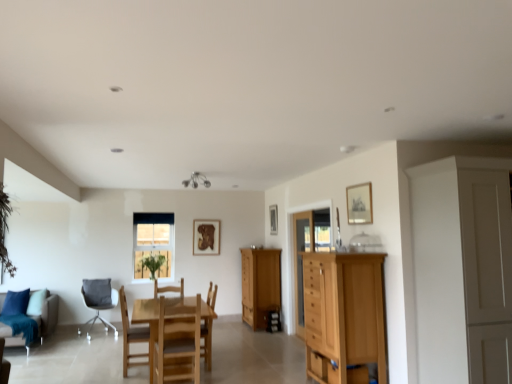
In order to click on light brown wood chest of drawers at right in this screenshot , I will do `click(344, 314)`.

How much space does transparent glass cabinet at center-right, acting as the second glass door starting from the left, occupy vertically?

transparent glass cabinet at center-right, acting as the second glass door starting from the left, is 2.08 meters tall.

I want to click on wooden chair at center, the third chair positioned from the left, so pos(133,338).

What is the approximate width of white fabric chair at lower left, which appears as the 4th chair when viewed from the front?

The width of white fabric chair at lower left, which appears as the 4th chair when viewed from the front, is 59.56 centimeters.

Describe the element at coordinates (47, 316) in the screenshot. I see `teal fabric couch at lower left` at that location.

Identify the location of light brown wood chest of drawers at right. (344, 314).

Does wooden picture frame at upper center, acting as the second picture frame starting from the right, touch wooden picture frame at upper right, arranged as the third picture frame when viewed from the left?

No, wooden picture frame at upper center, acting as the second picture frame starting from the right, is not in contact with wooden picture frame at upper right, arranged as the third picture frame when viewed from the left.

Find the location of a particular element. This screenshot has height=384, width=512. picture frame lying on the right of wooden picture frame at upper center, positioned as the second picture frame in front-to-back order is located at coordinates (359, 204).

Is wooden picture frame at upper center, positioned as the second picture frame in front-to-back order, surrounding wooden picture frame at upper right, marked as the first picture frame in a right-to-left arrangement?

Actually, wooden picture frame at upper right, marked as the first picture frame in a right-to-left arrangement, is outside wooden picture frame at upper center, positioned as the second picture frame in front-to-back order.

Measure the distance from wooden picture frame at upper center, positioned as the second picture frame in front-to-back order, to wooden picture frame at upper right, the 3th picture frame in the back-to-front sequence.

The distance of wooden picture frame at upper center, positioned as the second picture frame in front-to-back order, from wooden picture frame at upper right, the 3th picture frame in the back-to-front sequence, is 3.03 meters.

Is wooden picture frame at upper center, positioned as the second picture frame in front-to-back order, not close to wooden chair at center, the 3th chair positioned from the right?

Absolutely, wooden picture frame at upper center, positioned as the second picture frame in front-to-back order, is distant from wooden chair at center, the 3th chair positioned from the right.

Is point (273, 207) farther from camera compared to point (146, 330)?

Yes.

From a real-world perspective, is wooden picture frame at upper center, positioned as the second picture frame in front-to-back order, located beneath wooden chair at center, the second chair positioned from the left?

Incorrect, from a real-world perspective, wooden picture frame at upper center, positioned as the second picture frame in front-to-back order, is higher than wooden chair at center, the second chair positioned from the left.

From the image's perspective, between wooden picture frame at upper center, positioned as the second picture frame in front-to-back order, and wooden chair at center, the 3th chair positioned from the right, who is located below?

From the image's view, wooden chair at center, the 3th chair positioned from the right, is below.

Between wooden chair at center, the 4th chair when ordered from back to front, and green leafy plant at center, which one has larger width?

wooden chair at center, the 4th chair when ordered from back to front.

Considering the relative sizes of wooden chair at center, the first chair in the front-to-back sequence, and green leafy plant at center in the image provided, is wooden chair at center, the first chair in the front-to-back sequence, bigger than green leafy plant at center?

Yes, wooden chair at center, the first chair in the front-to-back sequence, is bigger than green leafy plant at center.

Is wooden chair at center, the first chair in the front-to-back sequence, in front of or behind green leafy plant at center in the image?

Clearly, wooden chair at center, the first chair in the front-to-back sequence, is in front of green leafy plant at center.

Measure the distance from wooden chair at center, the third chair positioned from the left, to green leafy plant at center.

A distance of 2.22 meters exists between wooden chair at center, the third chair positioned from the left, and green leafy plant at center.

How many degrees apart are the facing directions of wooden picture frame at upper center, acting as the 2th picture frame starting from the left, and teal fabric couch at lower left?

wooden picture frame at upper center, acting as the 2th picture frame starting from the left, and teal fabric couch at lower left are facing 90.4 degrees away from each other.

The width and height of the screenshot is (512, 384). In order to click on studio couch lying on the left of wooden picture frame at upper center, acting as the second picture frame starting from the right in this screenshot , I will do coord(47,316).

From a real-world perspective, is wooden picture frame at upper center, positioned as the 2th picture frame in back-to-front order, over teal fabric couch at lower left?

Correct, in the physical world, wooden picture frame at upper center, positioned as the 2th picture frame in back-to-front order, is higher than teal fabric couch at lower left.

Is wooden picture frame at upper center, positioned as the second picture frame in front-to-back order, completely or partially outside of teal fabric couch at lower left?

Absolutely, wooden picture frame at upper center, positioned as the second picture frame in front-to-back order, is external to teal fabric couch at lower left.

Is white fabric chair at lower left, marked as the 4th chair in a right-to-left arrangement, next to wooden cabinet at center?

Answer: No, white fabric chair at lower left, marked as the 4th chair in a right-to-left arrangement, is not touching wooden cabinet at center.

Considering the relative sizes of white fabric chair at lower left, which appears as the 4th chair when viewed from the front, and wooden cabinet at center in the image provided, is white fabric chair at lower left, which appears as the 4th chair when viewed from the front, taller than wooden cabinet at center?

No.

Would you say white fabric chair at lower left, marked as the 4th chair in a right-to-left arrangement, is to the left or to the right of wooden cabinet at center in the picture?

Based on their positions, white fabric chair at lower left, marked as the 4th chair in a right-to-left arrangement, is located to the left of wooden cabinet at center.

Are wooden picture frame at center, marked as the 3th picture frame in a right-to-left arrangement, and wooden frame at center far apart?

They are positioned close to each other.

Find the location of `the 1st picture frame counting from the right of the wooden frame at center`. the 1st picture frame counting from the right of the wooden frame at center is located at coordinates (206, 237).

From a real-world perspective, does wooden picture frame at center, which appears as the 3th picture frame when viewed from the front, stand above wooden frame at center?

Yes.

Is wooden picture frame at center, the first picture frame in the left-to-right sequence, taller or shorter than wooden frame at center?

In the image, wooden picture frame at center, the first picture frame in the left-to-right sequence, appears to be shorter than wooden frame at center.

In terms of size, does transparent glass cabinet at center, which is counted as the first glass door, starting from the left, appear bigger or smaller than wooden picture frame at upper center, acting as the 2th picture frame starting from the left?

Considering their sizes, transparent glass cabinet at center, which is counted as the first glass door, starting from the left, takes up more space than wooden picture frame at upper center, acting as the 2th picture frame starting from the left.

Does point (293, 233) come farther from viewer compared to point (270, 226)?

No, it is not.

Which object is further away from the camera taking this photo, transparent glass cabinet at center, the second glass door positioned from the right, or wooden picture frame at upper center, positioned as the 2th picture frame in back-to-front order?

Positioned behind is wooden picture frame at upper center, positioned as the 2th picture frame in back-to-front order.

Is transparent glass cabinet at center, the second glass door positioned from the right, aimed at wooden picture frame at upper center, acting as the 2th picture frame starting from the left?

No, transparent glass cabinet at center, the second glass door positioned from the right, is not aimed at wooden picture frame at upper center, acting as the 2th picture frame starting from the left.

This screenshot has width=512, height=384. What are the coordinates of `picture frame that is in front of the wooden picture frame at upper center, positioned as the second picture frame in front-to-back order` in the screenshot? It's located at (359, 204).

The image size is (512, 384). Identify the location of the 2nd picture frame positioned above the wooden chair at center, which appears as the 3th chair when viewed from the back (from a real-world perspective). (273, 219).

When comparing their distances from transparent glass cabinet at center-right, acting as the second glass door starting from the left, does wooden picture frame at upper right, the 3th picture frame in the back-to-front sequence, or wooden picture frame at upper center, acting as the 2th picture frame starting from the left, seem further?

The object further to transparent glass cabinet at center-right, acting as the second glass door starting from the left, is wooden picture frame at upper center, acting as the 2th picture frame starting from the left.

From the image, which object appears to be farther from wooden chair at center, the first chair in the front-to-back sequence, transparent glass cabinet at center, the second glass door positioned from the right, or wooden picture frame at upper right, arranged as the third picture frame when viewed from the left?

Among the two, wooden picture frame at upper right, arranged as the third picture frame when viewed from the left, is located further to wooden chair at center, the first chair in the front-to-back sequence.

Considering their positions, is transparent glass cabinet at center, the second glass door positioned from the right, positioned further to white fabric chair at lower left, positioned as the 1th chair in back-to-front order, than wooden picture frame at upper right, marked as the first picture frame in a right-to-left arrangement?

wooden picture frame at upper right, marked as the first picture frame in a right-to-left arrangement, is further to white fabric chair at lower left, positioned as the 1th chair in back-to-front order.

Based on the photo, considering their positions, is wooden chair at center, the 2th chair when ordered from front to back, positioned further to wooden cabinet at center than wooden frame at center?

wooden chair at center, the 2th chair when ordered from front to back.

Estimate the real-world distances between objects in this image. Which object is further from transparent glass cabinet at center-right, positioned as the first glass door in right-to-left order, wooden picture frame at upper center, positioned as the second picture frame in front-to-back order, or teal fabric couch at lower left?

Among the two, teal fabric couch at lower left is located further to transparent glass cabinet at center-right, positioned as the first glass door in right-to-left order.

From the picture: Based on their spatial positions, is wooden chair at center, the first chair in the front-to-back sequence, or wooden cabinet at center closer to transparent glass cabinet at center-right, positioned as the first glass door in right-to-left order?

wooden cabinet at center is positioned closer to the anchor transparent glass cabinet at center-right, positioned as the first glass door in right-to-left order.

Based on their spatial positions, is wooden picture frame at upper center, positioned as the 2th picture frame in back-to-front order, or transparent glass cabinet at center, the second glass door positioned from the right, further from teal fabric couch at lower left?

wooden picture frame at upper center, positioned as the 2th picture frame in back-to-front order, lies further to teal fabric couch at lower left than the other object.

From the image, which object appears to be farther from transparent glass cabinet at center, which is counted as the first glass door, starting from the left, transparent glass cabinet at center-right, acting as the second glass door starting from the left, or wooden picture frame at upper right, marked as the first picture frame in a right-to-left arrangement?

Among the two, wooden picture frame at upper right, marked as the first picture frame in a right-to-left arrangement, is located further to transparent glass cabinet at center, which is counted as the first glass door, starting from the left.

Find the location of a particular element. Image resolution: width=512 pixels, height=384 pixels. chair between wooden chair at center, marked as the second chair in a back-to-front arrangement, and wooden picture frame at center, arranged as the first picture frame when viewed from the back, from front to back is located at coordinates (99, 300).

Identify the location of plant located between wooden chair at center, the fourth chair in the left-to-right sequence, and wooden picture frame at upper center, acting as the 2th picture frame starting from the left, in the depth direction. (152, 264).

This screenshot has width=512, height=384. In order to click on glass door between light brown wood chest of drawers at right and transparent glass cabinet at center, the second glass door positioned from the right, in the front-back direction in this screenshot , I will do `click(307, 251)`.

Locate an element on the screen. The width and height of the screenshot is (512, 384). picture frame between green leafy plant at center and wooden cabinet at center from left to right is located at coordinates (206, 237).